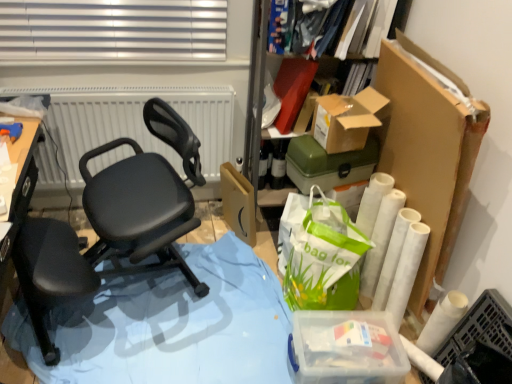
Question: From the image's perspective, is green plastic storage box at upper right, the 2th storage box positioned from the bottom, on clear plastic container at lower right, which ranks as the 2th storage box in top-to-bottom order?

Choices:
 (A) no
 (B) yes

Answer: (B)

Question: From the image's perspective, is green plastic storage box at upper right, the 2th storage box positioned from the bottom, under clear plastic container at lower right, which ranks as the 2th storage box in top-to-bottom order?

Choices:
 (A) yes
 (B) no

Answer: (B)

Question: Considering the relative positions of green plastic storage box at upper right, the 2th storage box positioned from the bottom, and clear plastic container at lower right, arranged as the first storage box when ordered from the bottom, in the image provided, is green plastic storage box at upper right, the 2th storage box positioned from the bottom, behind clear plastic container at lower right, arranged as the first storage box when ordered from the bottom,?

Choices:
 (A) yes
 (B) no

Answer: (A)

Question: Does green plastic storage box at upper right, the 2th storage box positioned from the bottom, turn towards clear plastic container at lower right, which ranks as the 2th storage box in top-to-bottom order?

Choices:
 (A) yes
 (B) no

Answer: (B)

Question: Is green plastic storage box at upper right, placed as the first storage box when sorted from top to bottom, at the right side of clear plastic container at lower right, arranged as the first storage box when ordered from the bottom?

Choices:
 (A) yes
 (B) no

Answer: (B)

Question: In terms of size, does matte brown cardboard box at center appear bigger or smaller than cardboard box at upper right?

Choices:
 (A) big
 (B) small

Answer: (A)

Question: From a real-world perspective, is matte brown cardboard box at center physically located above or below cardboard box at upper right?

Choices:
 (A) above
 (B) below

Answer: (B)

Question: In terms of width, does matte brown cardboard box at center look wider or thinner when compared to cardboard box at upper right?

Choices:
 (A) wide
 (B) thin

Answer: (B)

Question: Is matte brown cardboard box at center to the left or to the right of cardboard box at upper right in the image?

Choices:
 (A) left
 (B) right

Answer: (A)

Question: Do you think matte white radiator at upper center is within clear plastic container at lower right, arranged as the first storage box when ordered from the bottom, or outside of it?

Choices:
 (A) inside
 (B) outside

Answer: (B)

Question: Is matte white radiator at upper center in front of or behind clear plastic container at lower right, which ranks as the 2th storage box in top-to-bottom order, in the image?

Choices:
 (A) front
 (B) behind

Answer: (B)

Question: Is matte white radiator at upper center bigger or smaller than clear plastic container at lower right, arranged as the first storage box when ordered from the bottom?

Choices:
 (A) small
 (B) big

Answer: (B)

Question: Is matte white radiator at upper center wider or thinner than clear plastic container at lower right, arranged as the first storage box when ordered from the bottom?

Choices:
 (A) thin
 (B) wide

Answer: (A)

Question: In the image, is matte white radiator at upper center positioned in front of or behind blue plastic table at lower left?

Choices:
 (A) front
 (B) behind

Answer: (B)

Question: Is matte white radiator at upper center inside the boundaries of blue plastic table at lower left, or outside?

Choices:
 (A) inside
 (B) outside

Answer: (B)